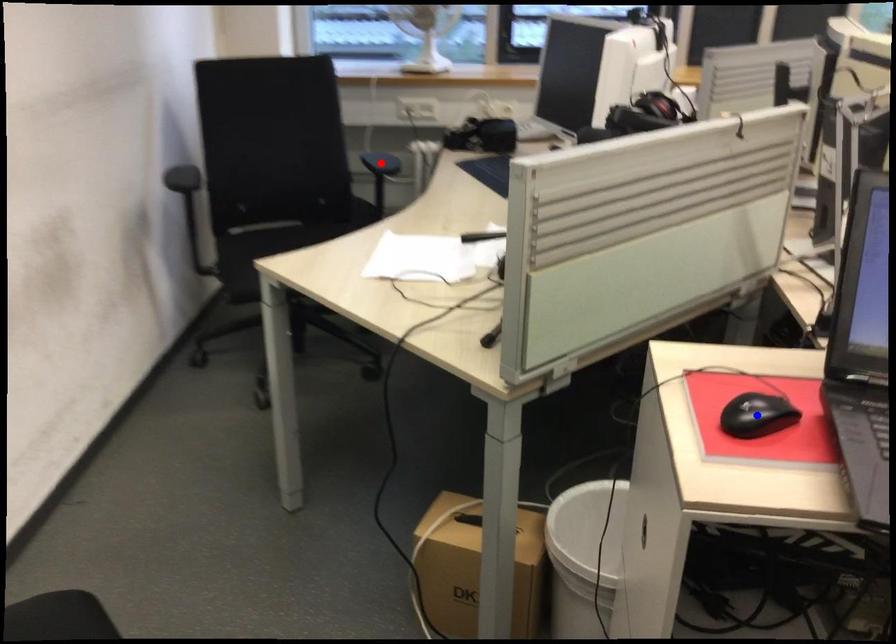
Question: Which of the two points in the image is closer to the camera?

Choices:
 (A) Blue point is closer.
 (B) Red point is closer.

Answer: (A)